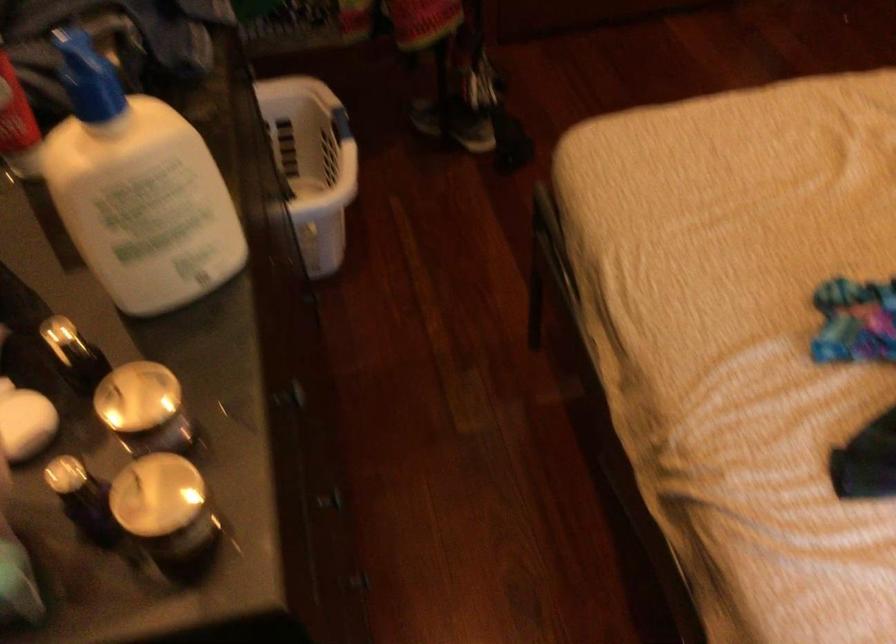
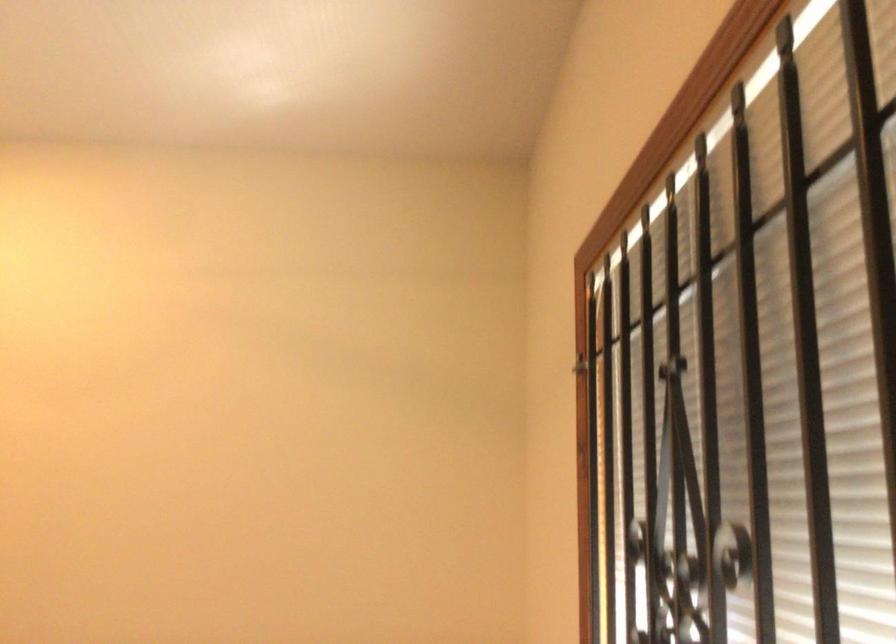
Based on the continuous images, in which direction is the camera rotating?

The camera's rotation is toward right-up.